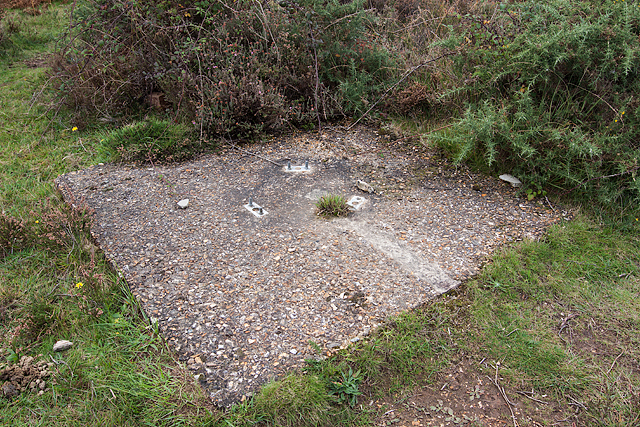
This screenshot has height=427, width=640. In order to click on bracket in this screenshot , I will do `click(256, 205)`, `click(298, 167)`, `click(355, 203)`.